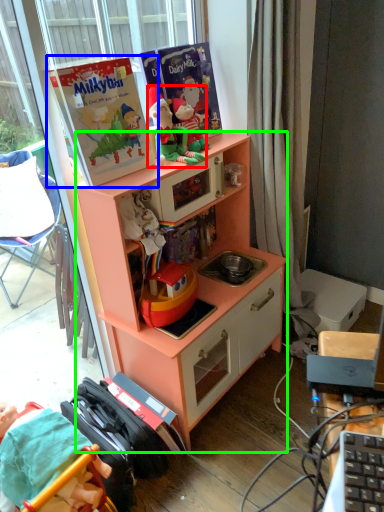
Question: Considering the real-world distances, which object is closest to person (highlighted by a red box)? paperback book (highlighted by a blue box) or cabinetry (highlighted by a green box).

Choices:
 (A) paperback book
 (B) cabinetry

Answer: (A)